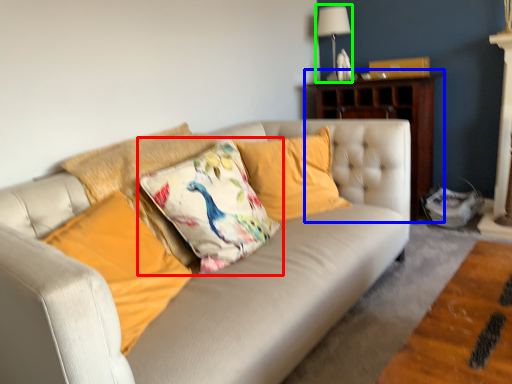
Question: Which object is the closest to the pillow (highlighted by a red box)? Choose among these: dresser (highlighted by a blue box) or lamp (highlighted by a green box).

Choices:
 (A) dresser
 (B) lamp

Answer: (A)